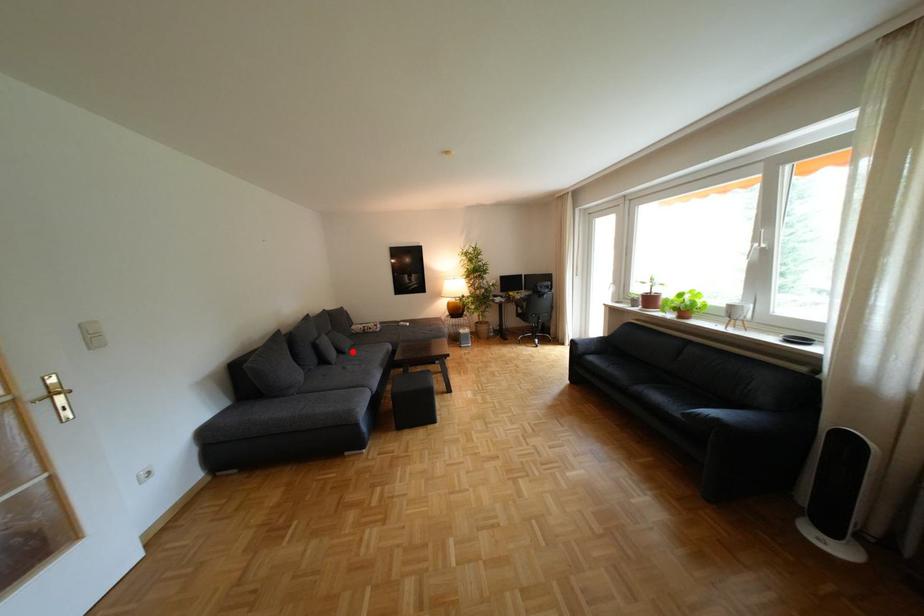
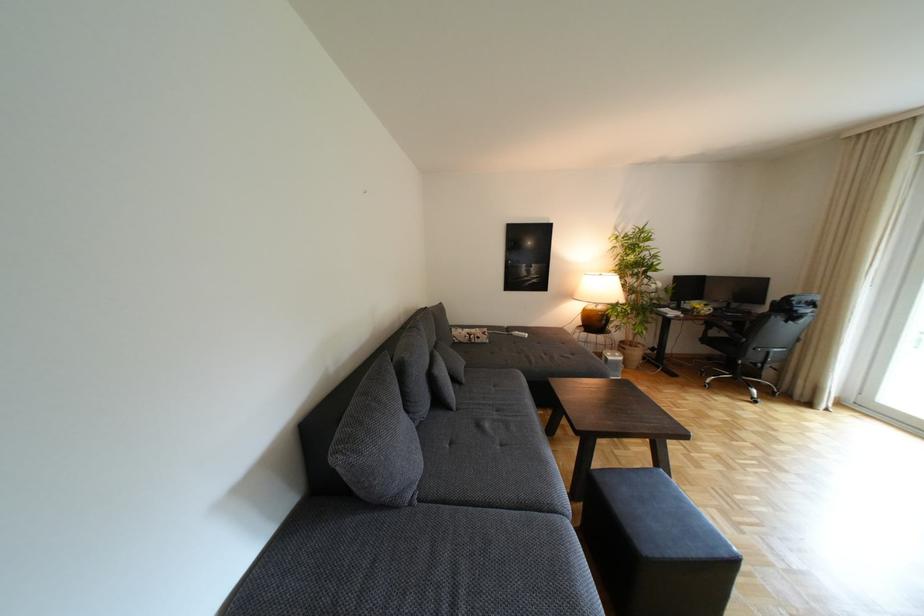
The point at the highlighted location is marked in the first image. Where is the corresponding point in the second image?

(468, 379)